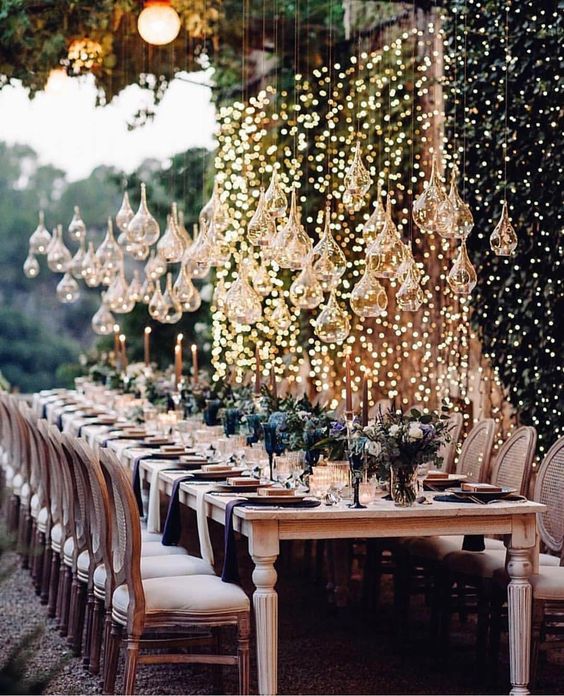
Where is `dark napkin`? dark napkin is located at coordinates (227, 521), (173, 509), (136, 472).